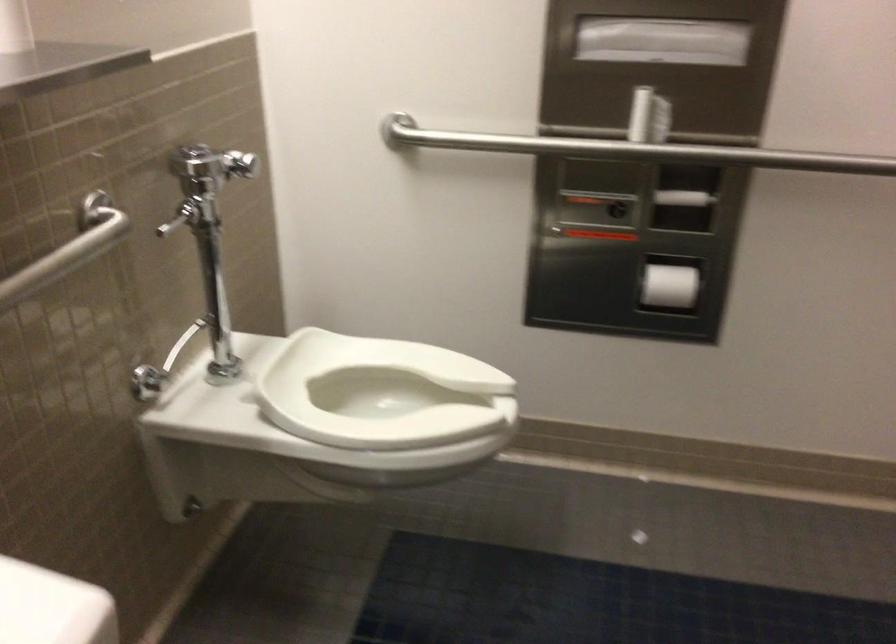
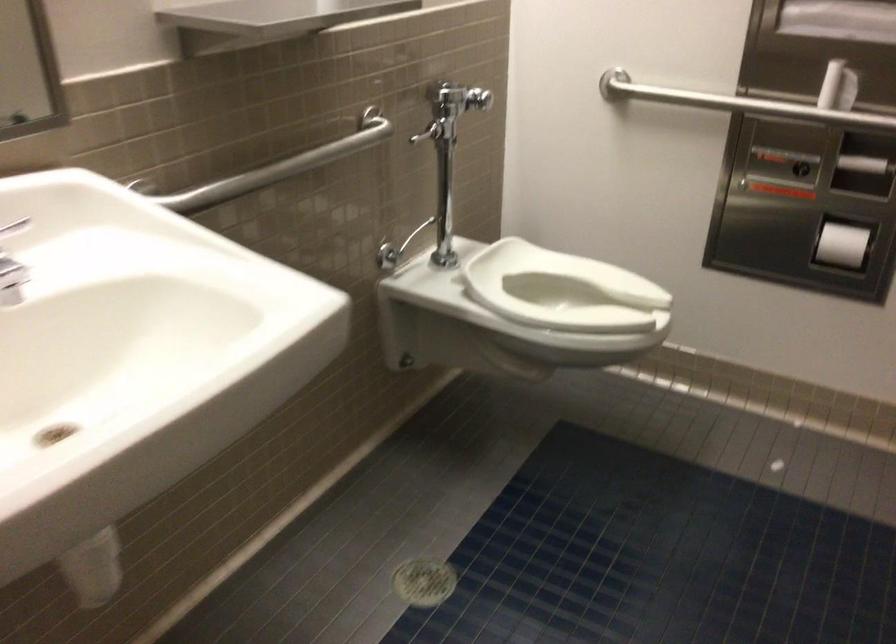
In the second image, find the point that corresponds to (x=673, y=292) in the first image.

(841, 245)